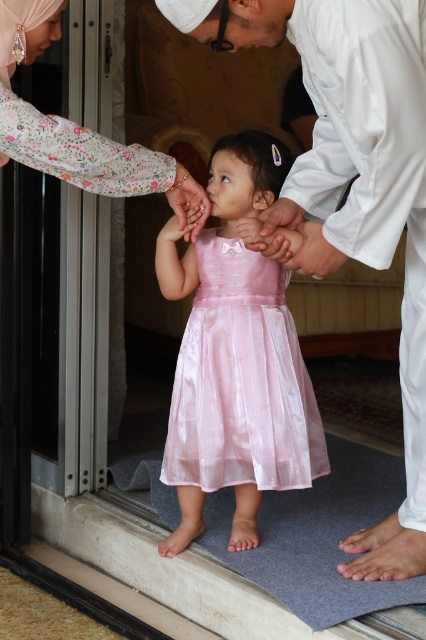
Who is more distant from viewer, (11, 99) or (204, 221)?

Point (204, 221)

Can you confirm if floral fabric hand at upper left is positioned above pink satin hand at center?

Yes.

Does point (5, 156) come behind point (184, 196)?

No, (5, 156) is closer to viewer.

Find the location of a particular element. The image size is (426, 640). floral fabric hand at upper left is located at coordinates (78, 129).

Consider the image. Is the position of white satin shirt at center more distant than that of pink satin hand at center?

No, it is in front of pink satin hand at center.

Which is above, white satin shirt at center or pink satin hand at center?

pink satin hand at center is above.

Between point (414, 184) and point (176, 195), which one is positioned behind?

The point (176, 195) is more distant.

The image size is (426, 640). Identify the location of white satin shirt at center. (354, 188).

What do you see at coordinates (354, 188) in the screenshot? The image size is (426, 640). I see `white satin shirt at center` at bounding box center [354, 188].

Between white satin shirt at center and shiny pink dress at center, which one appears on the left side from the viewer's perspective?

shiny pink dress at center

Who is more forward, (405,218) or (227,467)?

Point (405,218) is more forward.

You are a GUI agent. You are given a task and a screenshot of the screen. Output one action in this format:
    pyautogui.click(x=<x>, y=<y>)
    Task: Click on the white satin shirt at center
    This screenshot has width=426, height=640.
    Given the screenshot: What is the action you would take?
    pyautogui.click(x=354, y=188)